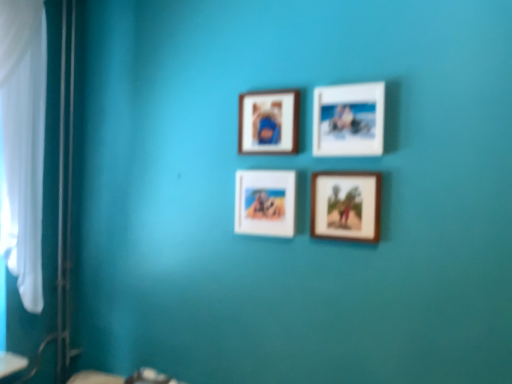
Question: Is wooden frame at upper center, arranged as the 3th picture frame when viewed from the right, at the right side of white matte picture frame at upper center, which is the 1th picture frame from right to left?

Choices:
 (A) yes
 (B) no

Answer: (B)

Question: From a real-world perspective, is wooden frame at upper center, arranged as the 3th picture frame when viewed from the right, below white matte picture frame at upper center, which is the 1th picture frame from right to left?

Choices:
 (A) no
 (B) yes

Answer: (B)

Question: Considering the relative sizes of wooden frame at upper center, the second picture frame positioned from the left, and white matte picture frame at upper center, arranged as the fourth picture frame when viewed from the left, in the image provided, is wooden frame at upper center, the second picture frame positioned from the left, thinner than white matte picture frame at upper center, arranged as the fourth picture frame when viewed from the left,?

Choices:
 (A) no
 (B) yes

Answer: (B)

Question: From a real-world perspective, is wooden frame at upper center, the second picture frame positioned from the left, on white matte picture frame at upper center, which is the 1th picture frame from right to left?

Choices:
 (A) yes
 (B) no

Answer: (B)

Question: From the image's perspective, is wooden frame at upper center, arranged as the 3th picture frame when viewed from the right, under white matte picture frame at upper center, arranged as the fourth picture frame when viewed from the left?

Choices:
 (A) yes
 (B) no

Answer: (B)

Question: Considering the positions of point (290, 105) and point (373, 195), is point (290, 105) closer or farther from the camera than point (373, 195)?

Choices:
 (A) closer
 (B) farther

Answer: (B)

Question: In the image, is wooden frame at upper center, the second picture frame positioned from the left, positioned in front of or behind wooden photo frame at lower right, which is the 3th picture frame in left-to-right order?

Choices:
 (A) behind
 (B) front

Answer: (A)

Question: Considering the positions of wooden frame at upper center, arranged as the 3th picture frame when viewed from the right, and wooden photo frame at lower right, the 2th picture frame when ordered from right to left, in the image, is wooden frame at upper center, arranged as the 3th picture frame when viewed from the right, wider or thinner than wooden photo frame at lower right, the 2th picture frame when ordered from right to left,?

Choices:
 (A) wide
 (B) thin

Answer: (A)

Question: From a real-world perspective, is wooden frame at upper center, the second picture frame positioned from the left, physically located above or below wooden photo frame at lower right, which is the 3th picture frame in left-to-right order?

Choices:
 (A) below
 (B) above

Answer: (B)

Question: Considering their positions, is wooden photo frame at lower right, which is the 3th picture frame in left-to-right order, located in front of or behind white matte picture frame at upper center, which is the 1th picture frame from right to left?

Choices:
 (A) behind
 (B) front

Answer: (A)

Question: From the image's perspective, relative to white matte picture frame at upper center, which is the 1th picture frame from right to left, is wooden photo frame at lower right, the 2th picture frame when ordered from right to left, above or below?

Choices:
 (A) below
 (B) above

Answer: (A)

Question: In terms of height, does wooden photo frame at lower right, which is the 3th picture frame in left-to-right order, look taller or shorter compared to white matte picture frame at upper center, arranged as the fourth picture frame when viewed from the left?

Choices:
 (A) tall
 (B) short

Answer: (B)

Question: Would you say wooden photo frame at lower right, which is the 3th picture frame in left-to-right order, is to the left or to the right of white matte picture frame at upper center, which is the 1th picture frame from right to left, in the picture?

Choices:
 (A) right
 (B) left

Answer: (B)

Question: Is wooden photo frame at lower right, the 2th picture frame when ordered from right to left, taller or shorter than matte wooden picture frame at center, which ranks as the first picture frame in left-to-right order?

Choices:
 (A) short
 (B) tall

Answer: (A)

Question: Considering the positions of wooden photo frame at lower right, which is the 3th picture frame in left-to-right order, and matte wooden picture frame at center, which ranks as the 4th picture frame in right-to-left order, in the image, is wooden photo frame at lower right, which is the 3th picture frame in left-to-right order, bigger or smaller than matte wooden picture frame at center, which ranks as the 4th picture frame in right-to-left order,?

Choices:
 (A) small
 (B) big

Answer: (A)